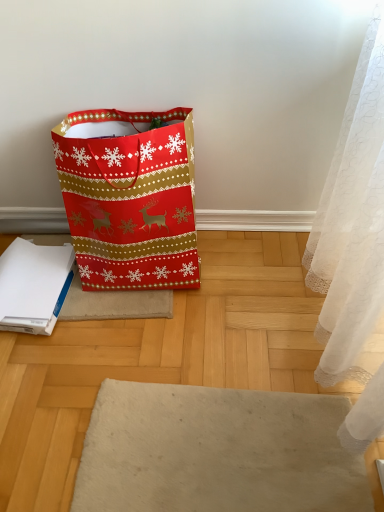
Where is `free location to the right of white paper notebook at lower left`? The height and width of the screenshot is (512, 384). free location to the right of white paper notebook at lower left is located at coordinates (105, 302).